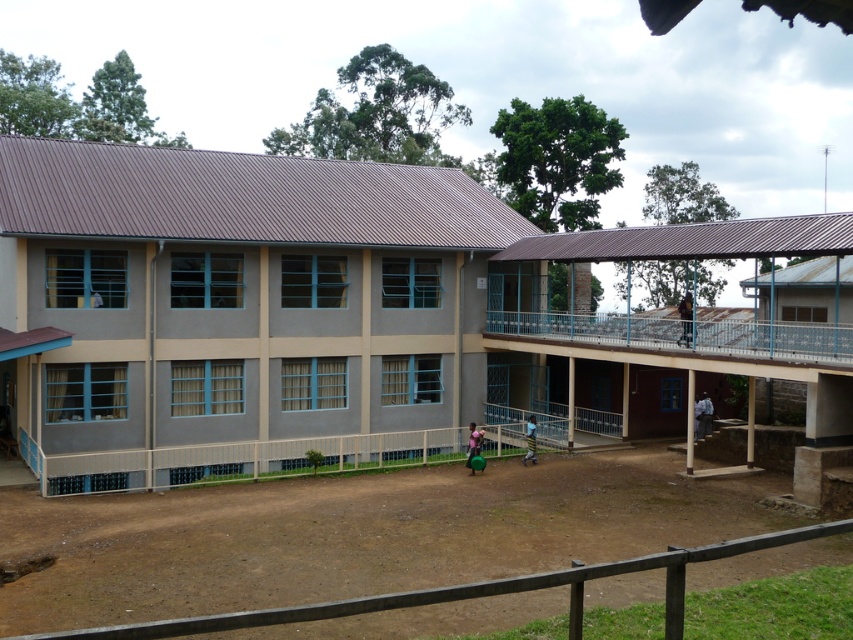
You are a student arriving at the school and notice the dark blue uniform at upper center and the pink fabric bag at center. Which item is bigger in size?

The dark blue uniform at upper center is larger in size than the pink fabric bag at center.

You are standing outside the two story building and see the point marked at coordinates (685,317). What color is the object located at that point?

The object at point (685,317) is a dark blue uniform at upper center.